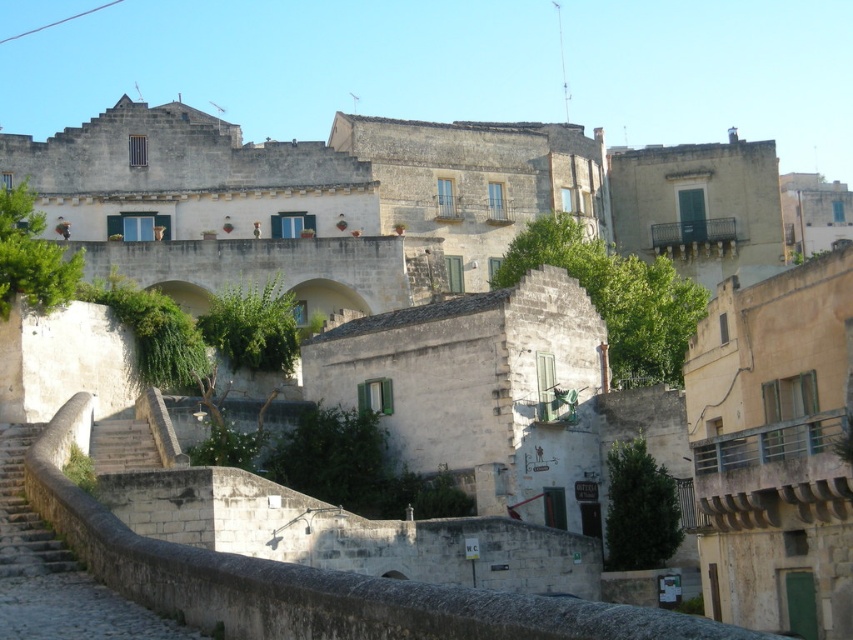
Between stone stairs at lower left and smooth stone stairs at lower left, which one appears on the left side from the viewer's perspective?

Positioned to the left is stone stairs at lower left.

Is point (12, 563) farther from camera compared to point (140, 467)?

No, it is not.

Locate an element on the screen. stone stairs at lower left is located at coordinates (24, 515).